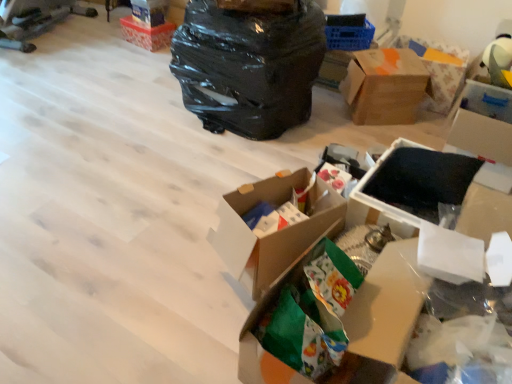
Find the location of a particular element. Image resolution: width=512 pixels, height=384 pixels. vacant space in front of black plastic bag at upper center is located at coordinates (204, 159).